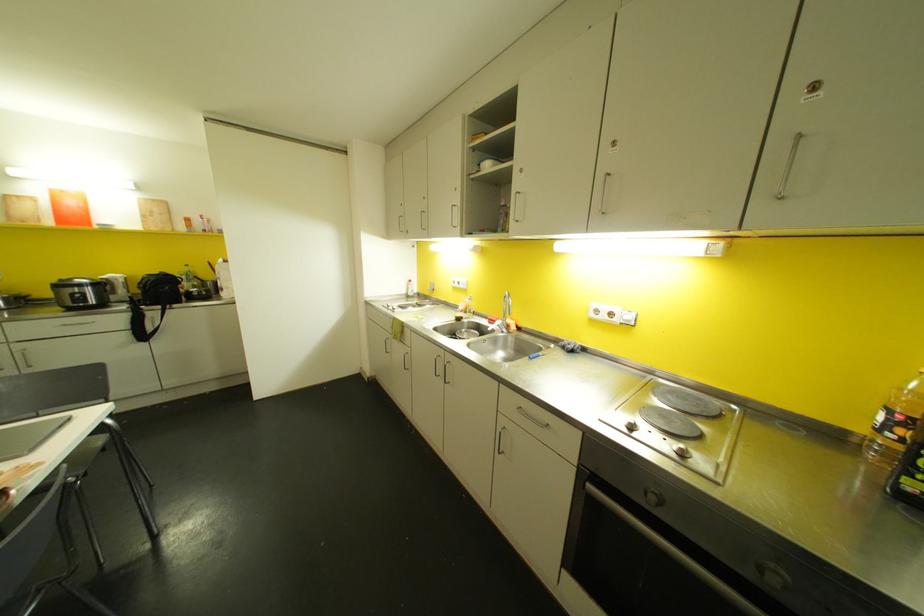
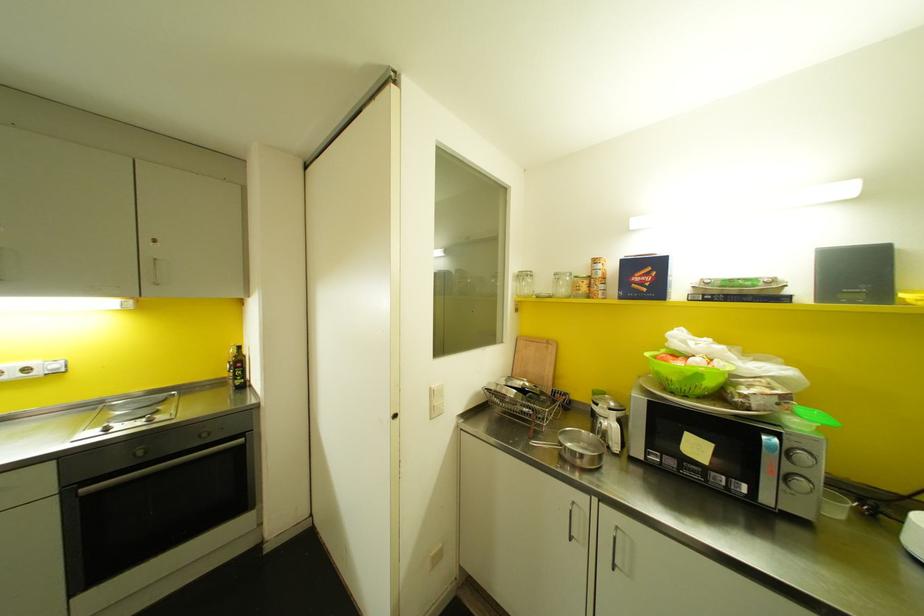
Locate, in the second image, the point that corresponds to the point at 682,454 in the first image.

(150, 419)